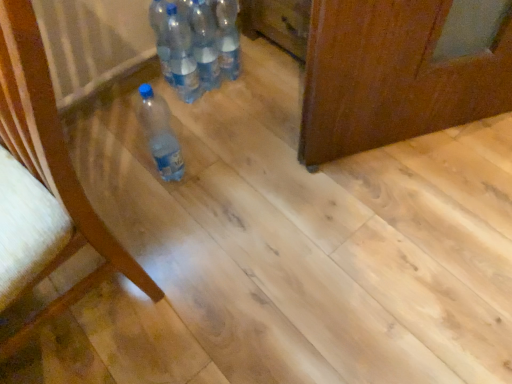
Identify the location of vacant space to the right of translucent plastic bottle at lower left, marked as the 1th bottle in a bottom-to-top arrangement. The height and width of the screenshot is (384, 512). (223, 170).